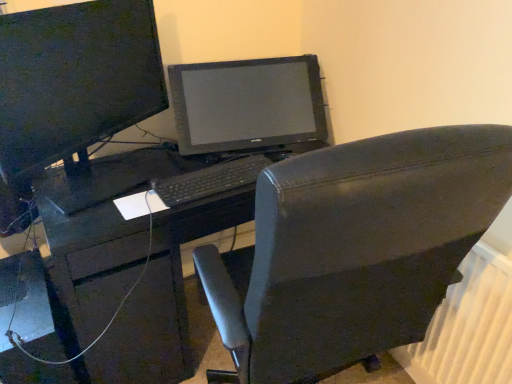
The width and height of the screenshot is (512, 384). I want to click on free space behind black plastic keyboard at center, so click(208, 154).